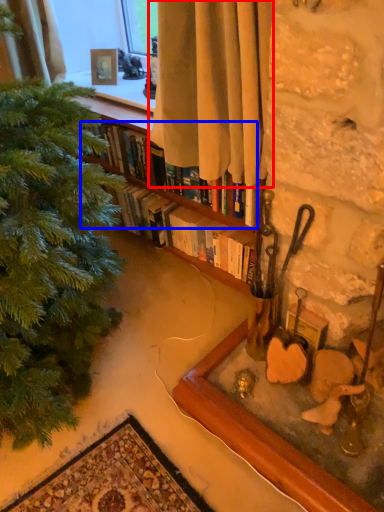
Question: Which point is closer to the camera, curtain (highlighted by a red box) or book (highlighted by a blue box)?

Choices:
 (A) curtain
 (B) book

Answer: (A)